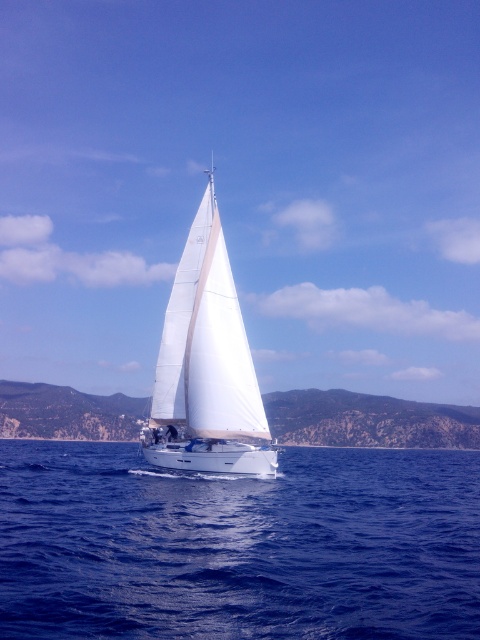
You are a photographer on a nearby boat and want to capture the white matte sailboat at center and the blue liquid water at center in your shot. From your perspective, which object is located to the right of the other?

The blue liquid water at center is positioned on the right side of white matte sailboat at center, so the blue liquid water at center is to the right of the white matte sailboat at center.

From the picture: You are a passenger on the white matte sailboat at center. You want to jump into the blue liquid water at center. Is the water directly in front of the sailboat?

The blue liquid water at center is in front of the white matte sailboat at center, so yes, the water is directly in front of the sailboat. You can jump in safely.

You are standing on the deck of the sailboat and want to pour a bottle of water into the blue liquid water at center. Where should you aim to ensure the bottle touches the water first?

You should aim for the point at coordinates (x=238, y=545) where the blue liquid water at center is located to ensure the bottle touches the water first.